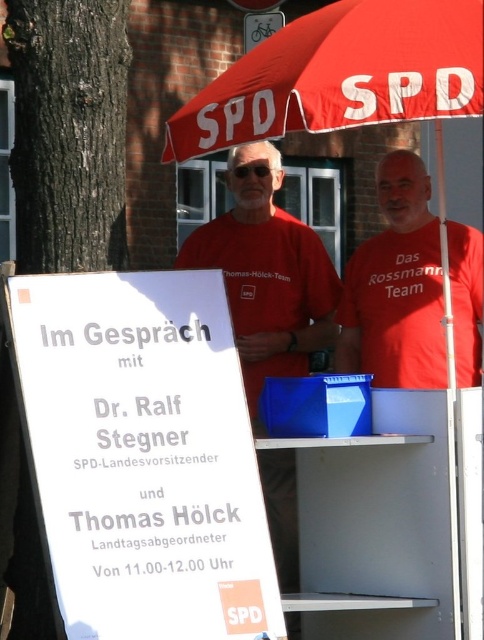
What is the location of the point with coordinates (342, 74) in the image?

The point with coordinates (342, 74) is located on the red fabric umbrella at upper center.